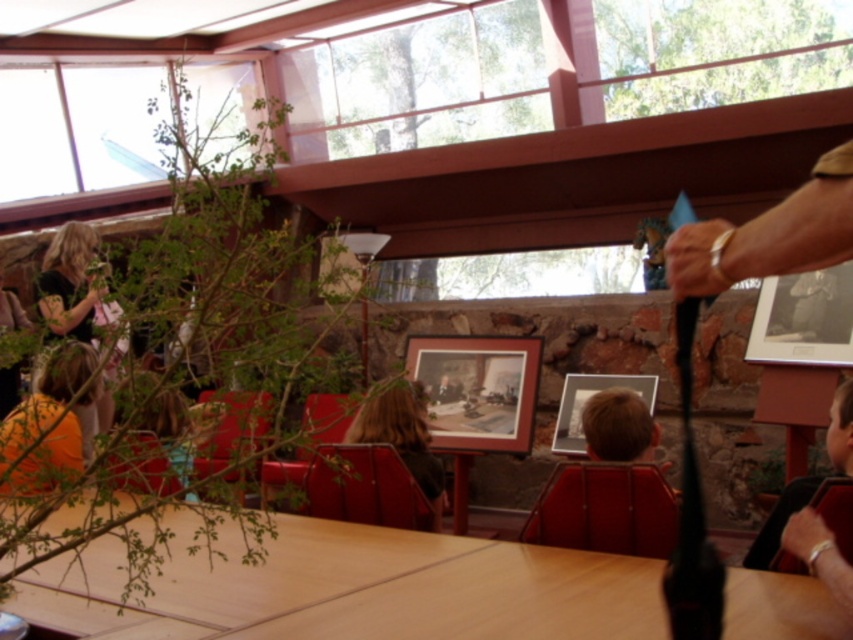
Which is in front, point (467, 352) or point (599, 387)?

Positioned in front is point (599, 387).

Is point (442, 340) closer to viewer compared to point (560, 449)?

No, (442, 340) is behind (560, 449).

Which is in front, point (485, 397) or point (595, 378)?

Positioned in front is point (485, 397).

Identify the location of wooden framed picture at center. The width and height of the screenshot is (853, 640). (477, 388).

Who is higher up, light brown wood table at center or wooden framed picture at center?

Positioned higher is wooden framed picture at center.

Between light brown wood table at center and wooden framed picture at center, which one is positioned lower?

Positioned lower is light brown wood table at center.

The image size is (853, 640). I want to click on light brown wood table at center, so click(355, 588).

Which is above, light brown wood table at center or matte black picture frame at upper right?

matte black picture frame at upper right is above.

Can you confirm if light brown wood table at center is thinner than matte black picture frame at upper right?

Incorrect, light brown wood table at center's width is not less than matte black picture frame at upper right's.

This screenshot has height=640, width=853. I want to click on light brown wood table at center, so click(x=355, y=588).